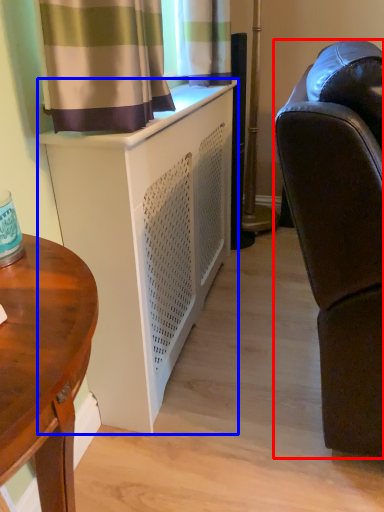
Question: Which of the following is the farthest to the observer, studio couch (highlighted by a red box) or cabinetry (highlighted by a blue box)?

Choices:
 (A) studio couch
 (B) cabinetry

Answer: (B)